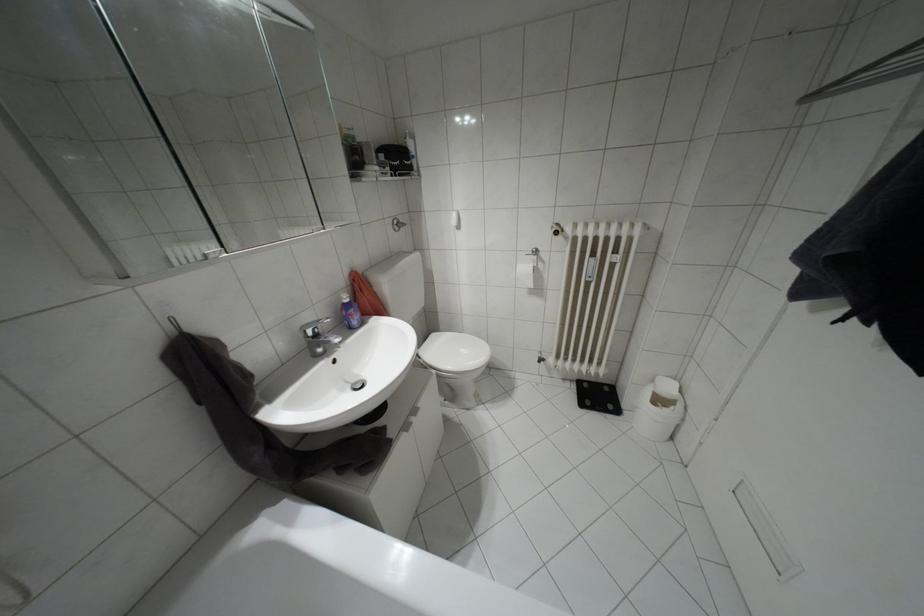
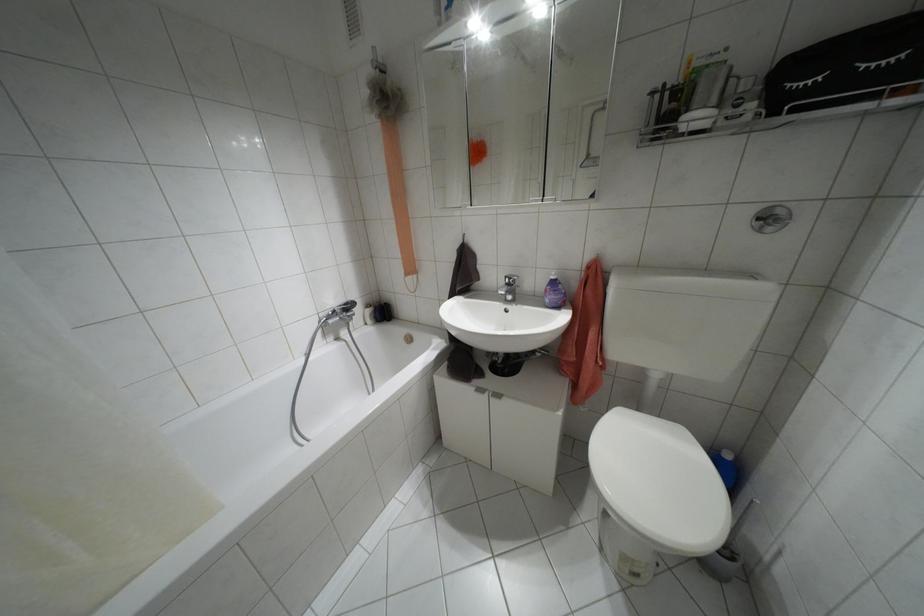
Find the pixel in the second image that matches (315,334) in the first image.

(507, 284)